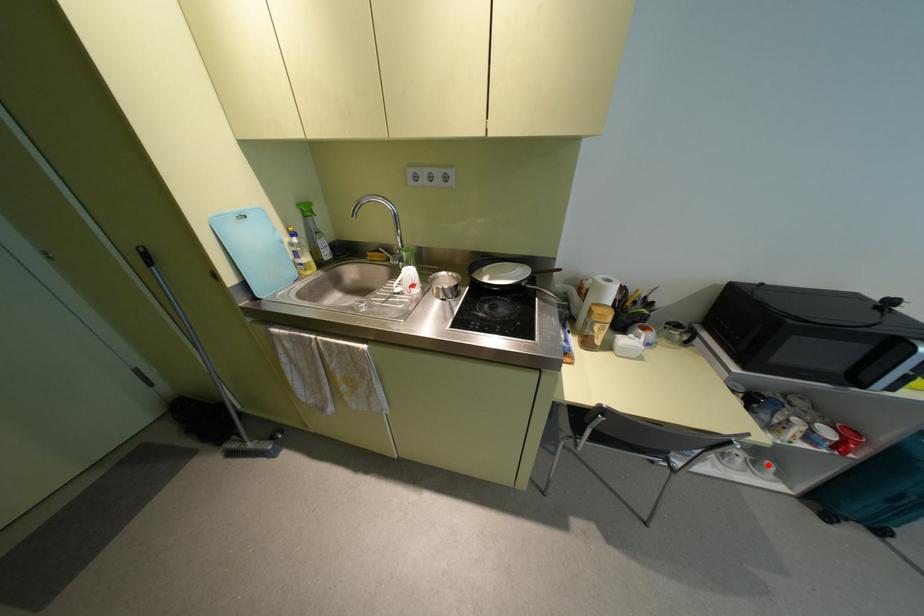
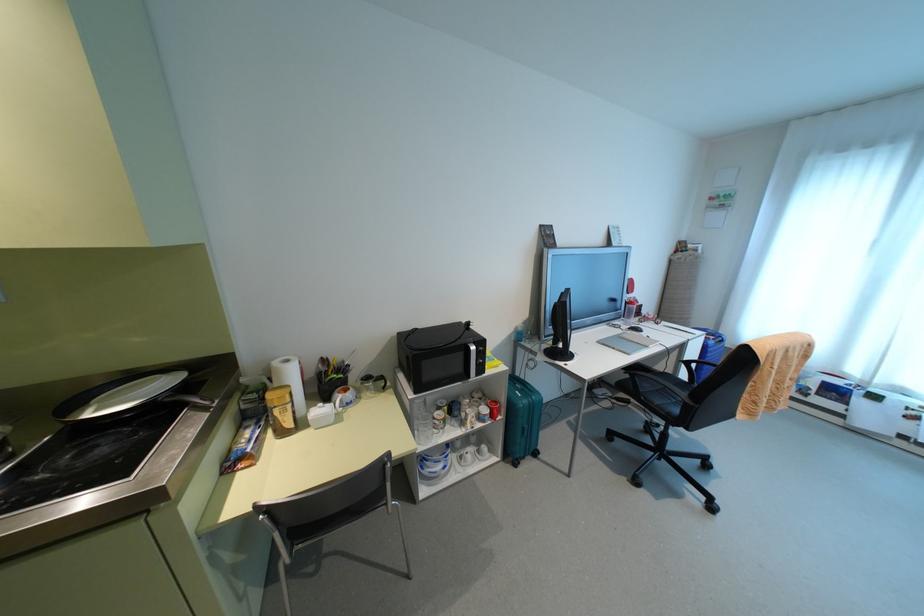
In the second image, find the point that corresponds to the highlighted location in the first image.

(483, 447)